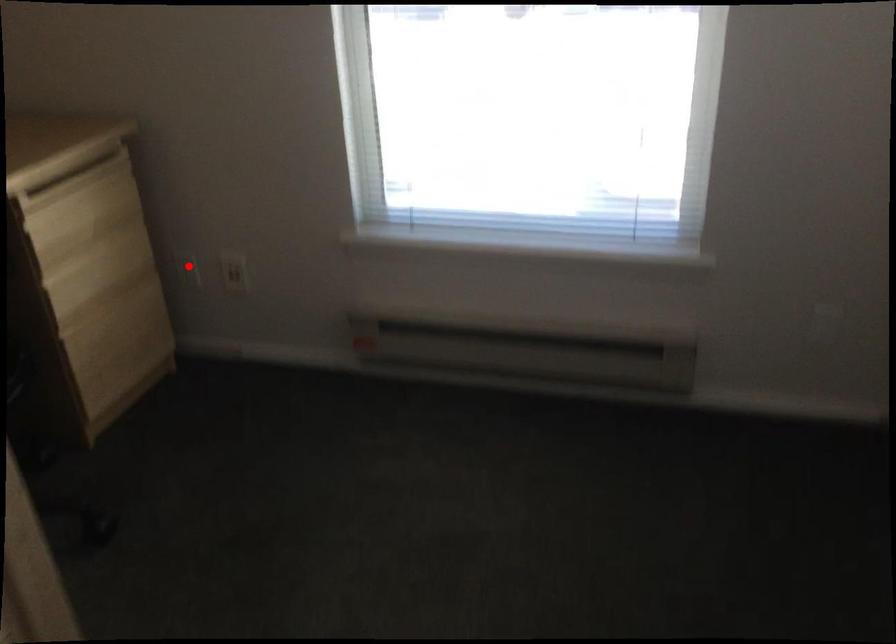
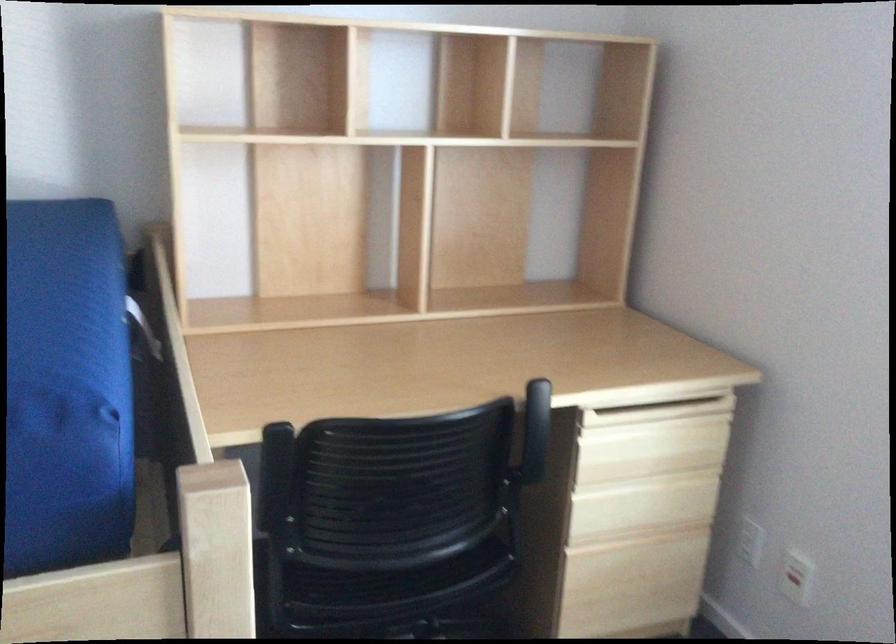
Question: A red point is marked in image1. In image2, is the corresponding 3D point closer to the camera or farther? Reply with the corresponding letter.

Choices:
 (A) The corresponding 3D point is closer.
 (B) The corresponding 3D point is farther.

Answer: (A)